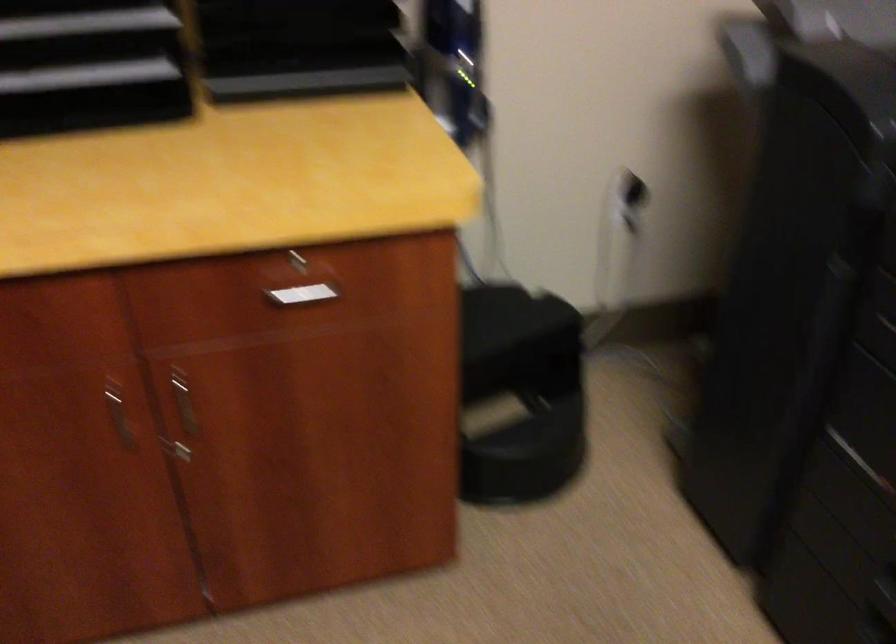
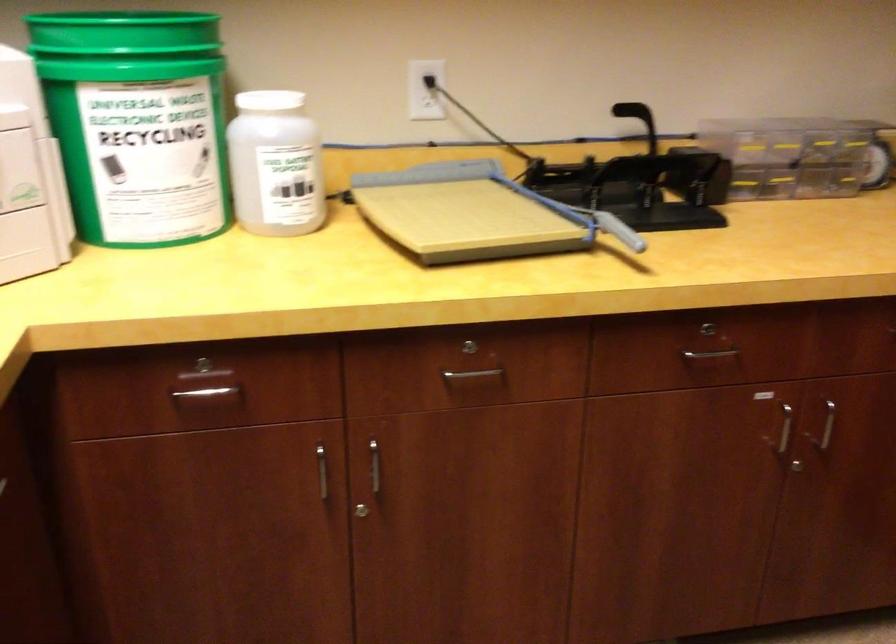
How did the camera likely rotate?

The rotation direction of the camera is left-down.